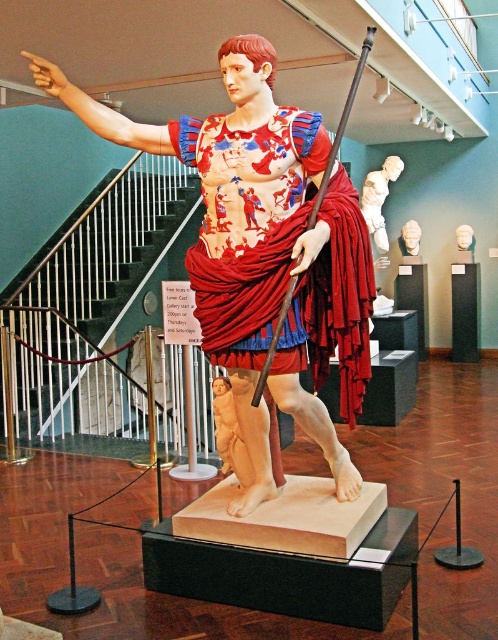
Question: Where is matte white bust at center located in relation to white marble mask at upper center in the image?

Choices:
 (A) above
 (B) below

Answer: (B)

Question: Can you confirm if red draped cloth at center is positioned above matte white bust at center?

Choices:
 (A) yes
 (B) no

Answer: (B)

Question: Among these points, which one is farthest from the camera?

Choices:
 (A) (463, 241)
 (B) (414, 243)

Answer: (B)

Question: Where is red draped cloth at center located in relation to white marble mask at upper center in the image?

Choices:
 (A) below
 (B) above

Answer: (A)

Question: Which of the following is the farthest from the observer?

Choices:
 (A) matte white bust at center
 (B) red draped cloth at center

Answer: (A)

Question: Estimate the real-world distances between objects in this image. Which object is farther from the white marble mask at upper center?

Choices:
 (A) white marble statue at center
 (B) matte white bust at center
 (C) matte red fabric at center

Answer: (C)